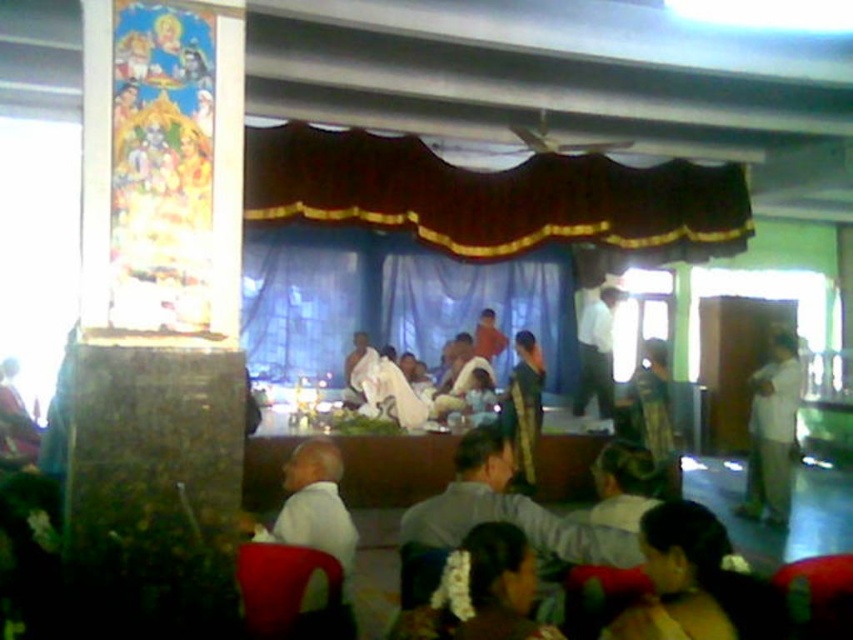
Question: Among these objects, which one is nearest to the camera?

Choices:
 (A) blue fabric curtain at center
 (B) dark brown fabric at upper center
 (C) white matte shirt at lower left

Answer: (C)

Question: Is silk-like golden robe at center positioned behind white shirt at center?

Choices:
 (A) yes
 (B) no

Answer: (B)

Question: Which of the following is the farthest from the observer?

Choices:
 (A) dark brown fabric at upper center
 (B) silk-like golden robe at center
 (C) white cloth at center

Answer: (C)

Question: Which object is positioned closest to the white cloth at center?

Choices:
 (A) white shirt at center
 (B) white cloth at right

Answer: (A)

Question: Does dark brown fabric at upper center appear under silk-like golden robe at center?

Choices:
 (A) yes
 (B) no

Answer: (B)

Question: Can you confirm if silk-like golden robe at center is thinner than white shirt at center?

Choices:
 (A) yes
 (B) no

Answer: (A)